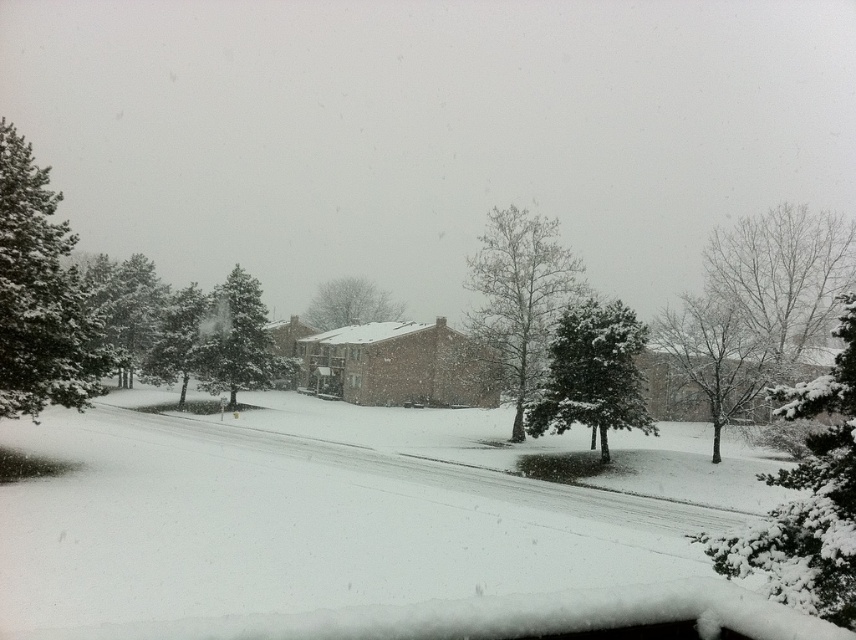
Looking at this image, is snow-covered pine tree at left to the right of snow-covered evergreen at center from the viewer's perspective?

No, snow-covered pine tree at left is not to the right of snow-covered evergreen at center.

Which is in front, point (21, 320) or point (542, 388)?

Point (21, 320) is more forward.

Identify the location of snow-covered pine tree at left. (40, 296).

Is point (92, 394) positioned in front of point (535, 298)?

Yes, it is in front of point (535, 298).

Between snow-covered pine tree at left and bare branches at center, which one is positioned higher?

bare branches at center is higher up.

Find the location of a particular element. The height and width of the screenshot is (640, 856). snow-covered pine tree at left is located at coordinates (40, 296).

Between snow-covered evergreen at center and snow-covered evergreen at left, which one has less height?

snow-covered evergreen at center is shorter.

Is point (542, 428) closer to viewer compared to point (116, 260)?

Yes.

Locate an element on the screen. Image resolution: width=856 pixels, height=640 pixels. snow-covered evergreen at center is located at coordinates (592, 374).